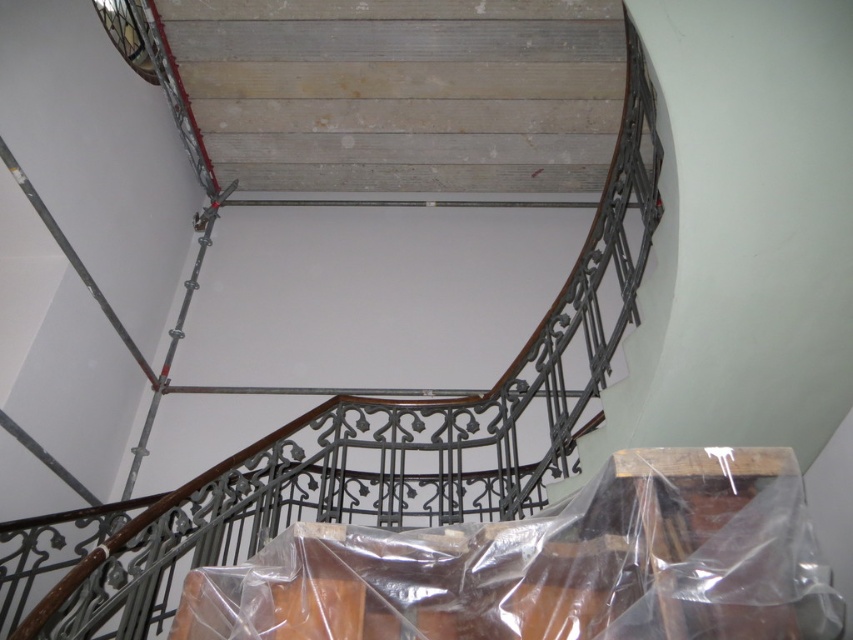
You are standing at the base of the spiral staircase and want to move towards the point that is closer to you. Which point should you head towards, point [521,40] or point [492,595]?

Point [492,595] is closer to you, so you should head towards point [492,595].

Looking at this image, you are standing at the base of the spiral staircase and want to place a small potted plant exactly where the wooden stairs at upper center are located. According to the image, what are the 2D coordinates where you should place the plant?

The wooden stairs at upper center are located at coordinates point (x=405, y=92), so you should place the plant there.